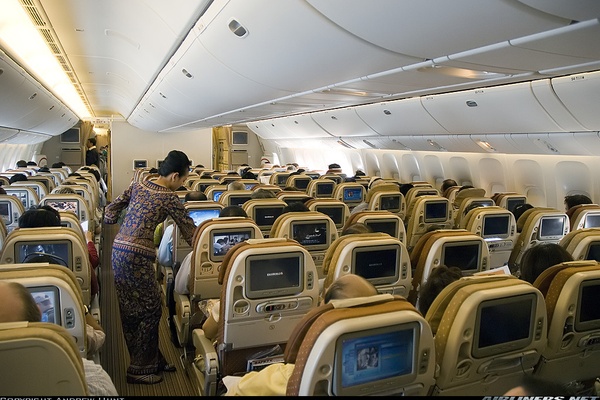
This screenshot has width=600, height=400. I want to click on overhead compartments, so click(235, 40), click(182, 74), click(170, 91), click(148, 114), click(47, 122), click(66, 126), click(34, 118), click(0, 94), click(20, 98).